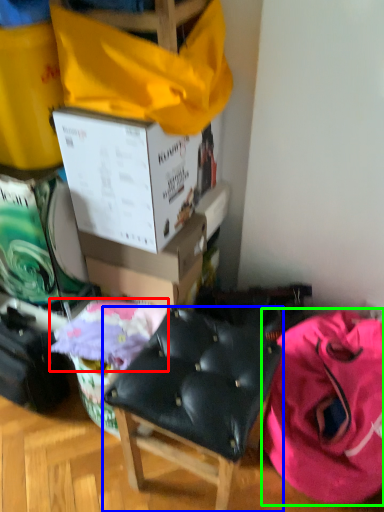
Question: Considering the real-world distances, which object is farthest from blanket (highlighted by a red box)? chair (highlighted by a blue box) or clothing (highlighted by a green box)?

Choices:
 (A) chair
 (B) clothing

Answer: (B)